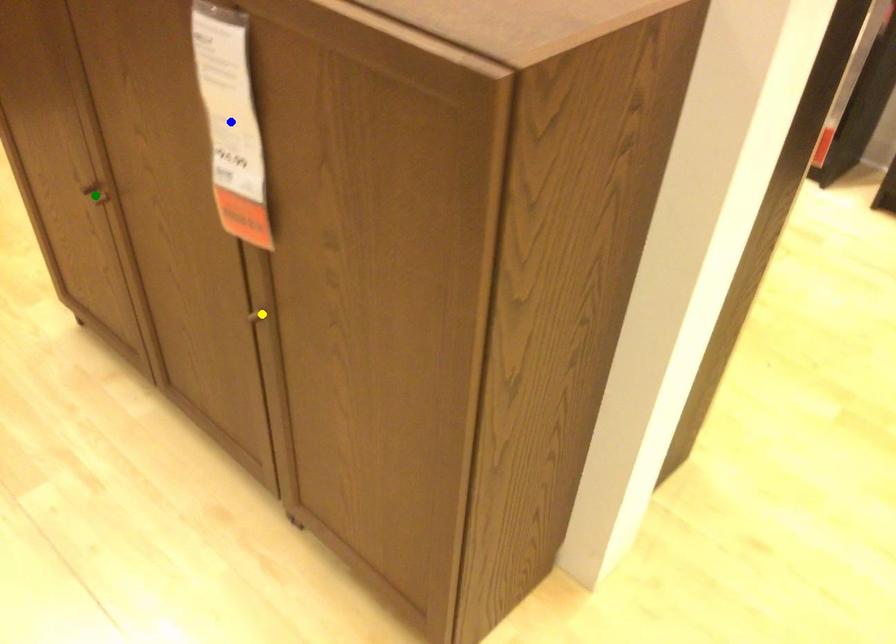
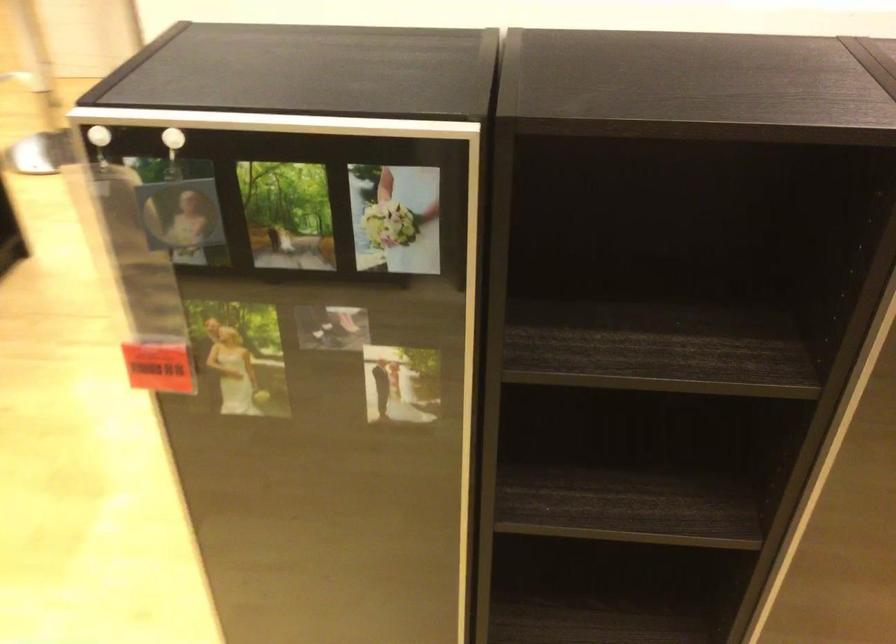
I am providing you with two images of the same scene from different viewpoints. Three points are marked in image1. Which point corresponds to a part or object that is occluded in image2?In image1, three points are marked. Which of them correspond to a part or object that is occluded in image2?Among the three points shown in image1, which one corresponds to a part or object that is no longer visible due to occlusion in image2?

blue point, yellow point, green point cannot be seen in image2.